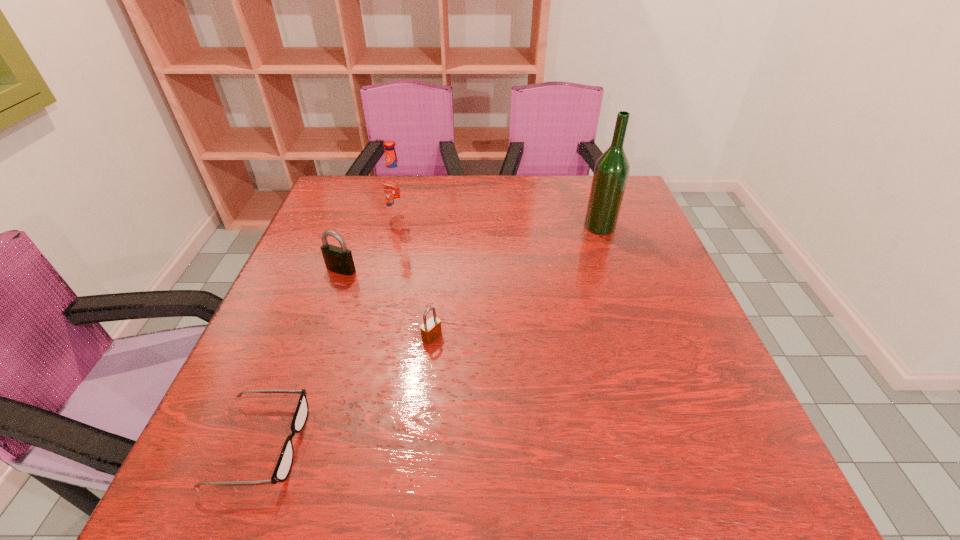
You are a GUI agent. You are given a task and a screenshot of the screen. Output one action in this format:
    pyautogui.click(x=<x>, y=<y>)
    Task: Click on the alcohol
    This screenshot has height=540, width=960.
    Given the screenshot: What is the action you would take?
    pyautogui.click(x=611, y=172)

Locate an element on the screen. the tallest object is located at coordinates (611, 172).

In order to click on the third object from left to right in this screenshot , I will do `click(394, 182)`.

Where is `root beer`? This screenshot has width=960, height=540. root beer is located at coordinates (394, 182).

Identify the location of the third farthest object. This screenshot has width=960, height=540. (339, 260).

Where is `the third shortest object`? This screenshot has width=960, height=540. the third shortest object is located at coordinates (339, 260).

Find the location of a particular element. the second object from right to left is located at coordinates point(431,329).

This screenshot has width=960, height=540. In order to click on the nearer padlock in this screenshot , I will do `click(431, 329)`.

Identify the location of spectacles. (284, 464).

Identify the location of the nearest object. [x=284, y=464].